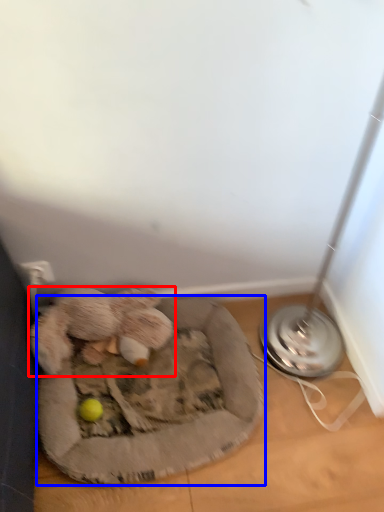
Question: Which of the following is the closest to the observer, toy (highlighted by a red box) or dog bed (highlighted by a blue box)?

Choices:
 (A) toy
 (B) dog bed

Answer: (B)